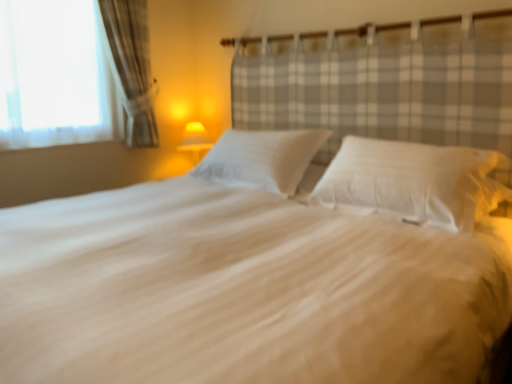
Question: In the image, is yellow fabric lampshade at center positioned in front of or behind white soft bed at center?

Choices:
 (A) front
 (B) behind

Answer: (B)

Question: From the image's perspective, is yellow fabric lampshade at center located above or below white soft bed at center?

Choices:
 (A) above
 (B) below

Answer: (A)

Question: Which object is positioned farthest from the yellow fabric lampshade at center?

Choices:
 (A) white soft pillow at center, positioned as the first pillow in left-to-right order
 (B) white soft bed at center
 (C) white soft pillow at center, marked as the 2th pillow in a left-to-right arrangement

Answer: (B)

Question: Considering the real-world distances, which object is farthest from the white soft pillow at center, the second pillow from the right?

Choices:
 (A) white soft pillow at center, marked as the 2th pillow in a left-to-right arrangement
 (B) yellow fabric lampshade at center
 (C) white soft bed at center

Answer: (B)